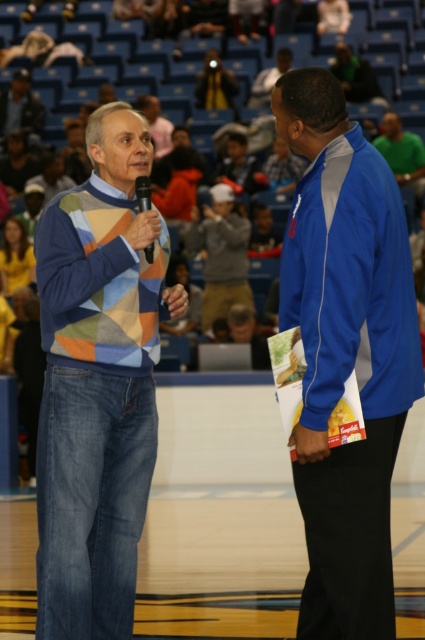
You are a sound technician standing near the black plastic microphone at center. You need to hand the microphone to the person wearing the patchwork sweater at left. Can you reach them without moving from your current position?

The patchwork sweater at left is 3.68 feet away from the black plastic microphone at center. Since the average human arm length is about 2.5 feet, you cannot reach them without moving closer.

You are a photographer at the basketball event. You need to capture a photo where both the patchwork sweater at left and the black plastic microphone at center are visible. Considering their sizes, which object should you ensure is closer to the camera to avoid it being too small in the photo?

The black plastic microphone at center is smaller in width than the patchwork sweater at left, so to ensure it isn not too small in the photo, you should position it closer to the camera.